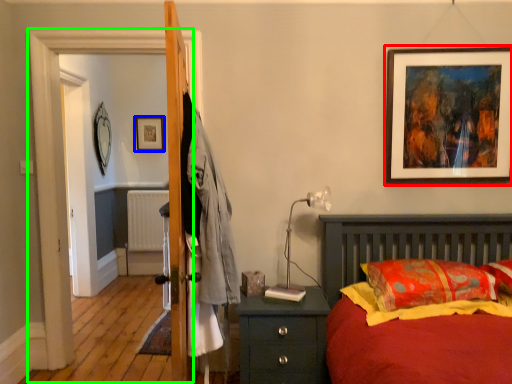
Question: Which object is the closest to the picture frame (highlighted by a red box)? Choose among these: picture frame (highlighted by a blue box) or screen door (highlighted by a green box).

Choices:
 (A) picture frame
 (B) screen door

Answer: (B)